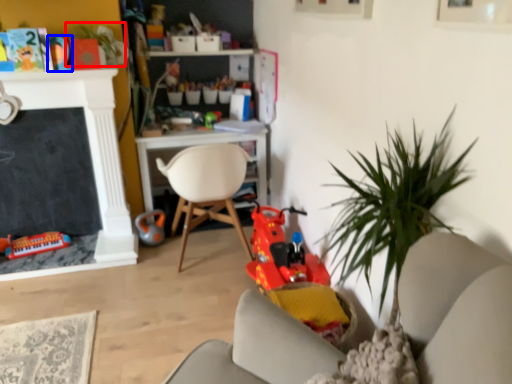
Question: Among these objects, which one is farthest to the camera, plant (highlighted by a red box) or toy (highlighted by a blue box)?

Choices:
 (A) plant
 (B) toy

Answer: (B)